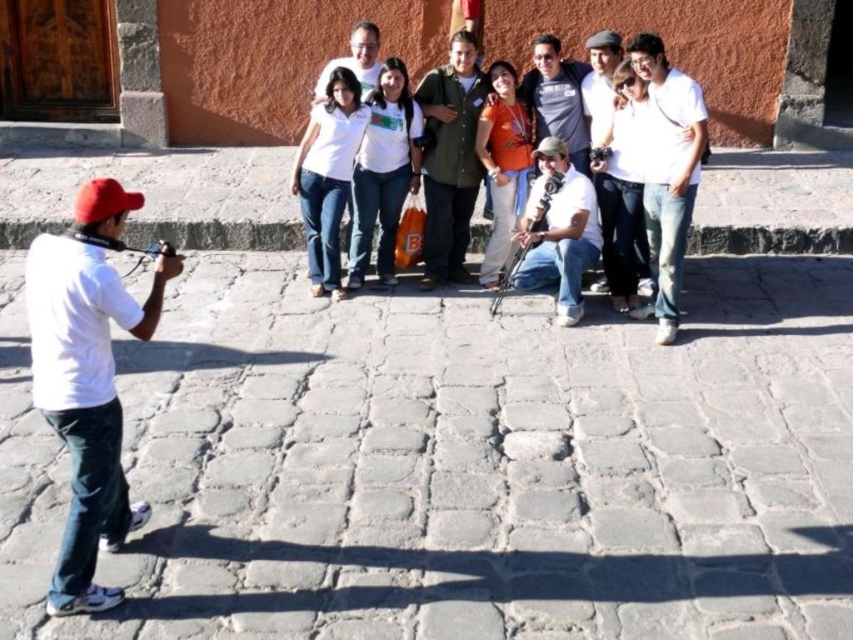
Question: Does white matte shirt at left lie behind green textured shirt at center?

Choices:
 (A) yes
 (B) no

Answer: (B)

Question: Can you confirm if white cotton shirt at upper right is positioned to the left of matte white shirt at center?

Choices:
 (A) no
 (B) yes

Answer: (A)

Question: Can you confirm if white matte shirt at left is positioned to the left of matte white shirt at center?

Choices:
 (A) no
 (B) yes

Answer: (B)

Question: Which of these objects is positioned closest to the white matte shirt at center?

Choices:
 (A) white cotton shirt at upper right
 (B) white matte shirt at left
 (C) green textured shirt at center
 (D) gray fabric shirt at center

Answer: (C)

Question: Which object is positioned farthest from the matte white shirt at center?

Choices:
 (A) white cotton shirt at upper right
 (B) white matte shirt at left

Answer: (B)

Question: Which object appears closest to the camera in this image?

Choices:
 (A) white matte shirt at left
 (B) white cotton shirt at upper right
 (C) green textured shirt at center

Answer: (A)